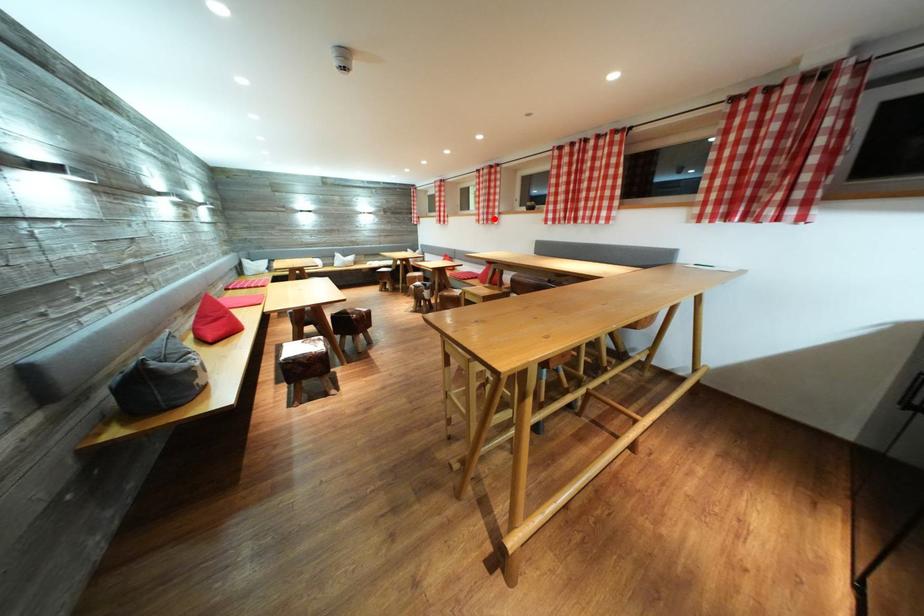
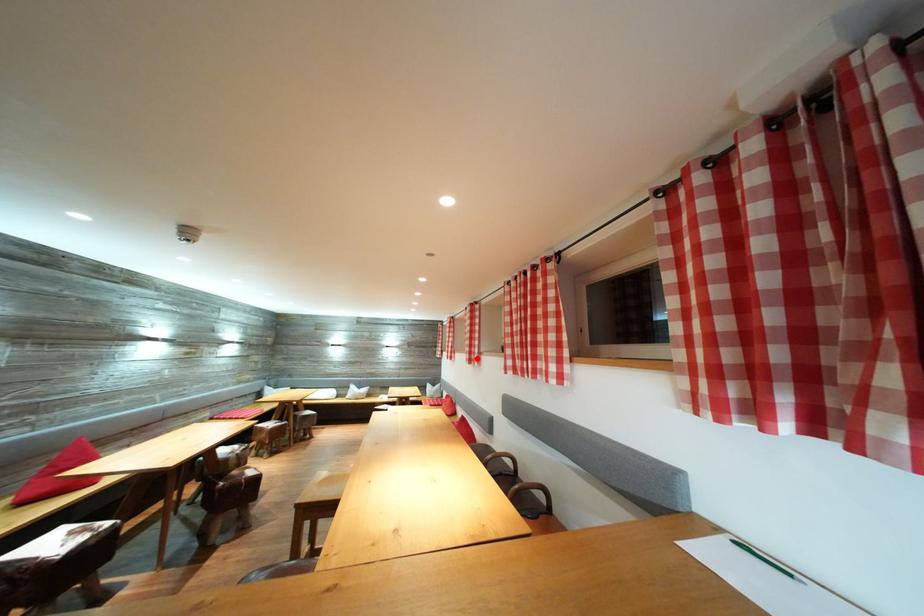
I am providing you with two images of the same scene from different viewpoints. A red point is marked on the first image and another point is marked on the second image. Are the points marked in image1 and image2 representing the same 3D position?

Yes